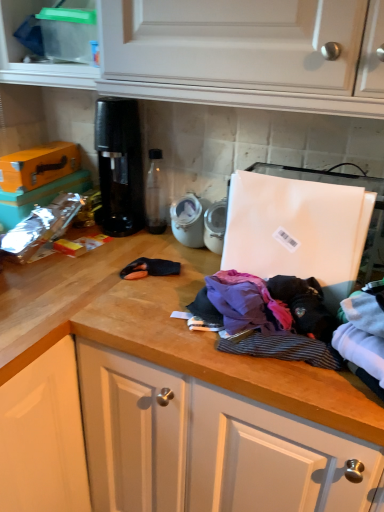
Question: From a real-world perspective, relative to striped cotton shirt at center, which ranks as the second clothing in left-to-right order, is purple cotton shirt at center, arranged as the third clothing when viewed from the left, vertically above or below?

Choices:
 (A) above
 (B) below

Answer: (A)

Question: Choose the correct answer: Is purple cotton shirt at center, the 2th clothing when ordered from right to left, inside striped cotton shirt at center, placed as the 3th clothing when sorted from right to left, or outside it?

Choices:
 (A) inside
 (B) outside

Answer: (B)

Question: Which of these objects is positioned farthest from the purple cotton shirt at center, the 2th clothing when ordered from right to left?

Choices:
 (A) black plastic coffee machine at center
 (B) white cotton socks at lower right, placed as the first clothing when sorted from right to left
 (C) purple fabric at center, which is the first clothing in left-to-right order
 (D) striped cotton shirt at center, which ranks as the second clothing in left-to-right order
 (E) clear plastic container at upper left

Answer: (E)

Question: Which object is positioned closest to the purple cotton shirt at center, the 2th clothing when ordered from right to left?

Choices:
 (A) white cotton socks at lower right, placed as the first clothing when sorted from right to left
 (B) striped cotton shirt at center, placed as the 3th clothing when sorted from right to left
 (C) clear plastic container at upper left
 (D) purple fabric at center, which is the fourth clothing in right-to-left order
 (E) black plastic coffee machine at center

Answer: (B)